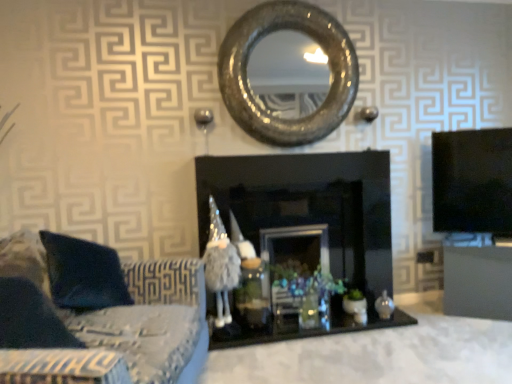
Question: Looking at their shapes, would you say matte black cabinet at right is wider or thinner than fuzzy fabric wizard at center?

Choices:
 (A) wide
 (B) thin

Answer: (A)

Question: Choose the correct answer: Is matte black cabinet at right inside fuzzy fabric wizard at center or outside it?

Choices:
 (A) inside
 (B) outside

Answer: (B)

Question: Considering the real-world distances, which object is closest to the shiny metallic mirror at center?

Choices:
 (A) fuzzy fabric wizard at center
 (B) black glossy fireplace at center
 (C) suede-like fabric couch at lower left
 (D) matte black cabinet at right

Answer: (B)

Question: Estimate the real-world distances between objects in this image. Which object is farther from the black glossy fireplace at center?

Choices:
 (A) suede-like fabric couch at lower left
 (B) shiny metallic mirror at center
 (C) matte black cabinet at right
 (D) fuzzy fabric wizard at center

Answer: (A)